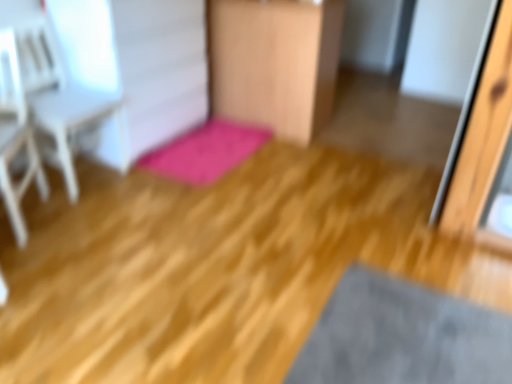
Question: Does white wood armchair at upper left, which is the second armchair from front to back, appear on the left side of wooden chair at center?

Choices:
 (A) yes
 (B) no

Answer: (A)

Question: Is white wood armchair at upper left, which is the second armchair from front to back, to the right of wooden chair at center from the viewer's perspective?

Choices:
 (A) yes
 (B) no

Answer: (B)

Question: Is white wood armchair at upper left, which is the second armchair from front to back, not within wooden chair at center?

Choices:
 (A) yes
 (B) no

Answer: (A)

Question: From a real-world perspective, does white wood armchair at upper left, placed as the first armchair when sorted from back to front, stand above wooden chair at center?

Choices:
 (A) no
 (B) yes

Answer: (A)

Question: From a real-world perspective, is white wood armchair at upper left, placed as the first armchair when sorted from back to front, located beneath wooden chair at center?

Choices:
 (A) yes
 (B) no

Answer: (A)

Question: From their relative heights in the image, would you say white wood armchair at left, which is the 2th armchair from back to front, is taller or shorter than white wood armchair at upper left, placed as the first armchair when sorted from back to front?

Choices:
 (A) tall
 (B) short

Answer: (B)

Question: Looking at the image, does white wood armchair at left, the 1th armchair from the front, seem bigger or smaller compared to white wood armchair at upper left, placed as the first armchair when sorted from back to front?

Choices:
 (A) big
 (B) small

Answer: (B)

Question: From a real-world perspective, relative to white wood armchair at upper left, which is the second armchair from front to back, is white wood armchair at left, which is the 2th armchair from back to front, vertically above or below?

Choices:
 (A) below
 (B) above

Answer: (A)

Question: Considering their positions, is white wood armchair at left, the 1th armchair from the front, located in front of or behind white wood armchair at upper left, placed as the first armchair when sorted from back to front?

Choices:
 (A) front
 (B) behind

Answer: (A)

Question: From the image's perspective, relative to pink plush bath mat at center, is white wood armchair at left, the 1th armchair from the front, above or below?

Choices:
 (A) above
 (B) below

Answer: (B)

Question: Is point (0, 183) closer or farther from the camera than point (209, 182)?

Choices:
 (A) farther
 (B) closer

Answer: (B)

Question: Is white wood armchair at left, the 1th armchair from the front, taller or shorter than pink plush bath mat at center?

Choices:
 (A) short
 (B) tall

Answer: (B)

Question: Considering their positions, is white wood armchair at left, the 1th armchair from the front, located in front of or behind pink plush bath mat at center?

Choices:
 (A) behind
 (B) front

Answer: (B)

Question: Is pink plush bath mat at center taller or shorter than wooden chair at center?

Choices:
 (A) tall
 (B) short

Answer: (B)

Question: From a real-world perspective, is pink plush bath mat at center positioned above or below wooden chair at center?

Choices:
 (A) above
 (B) below

Answer: (B)